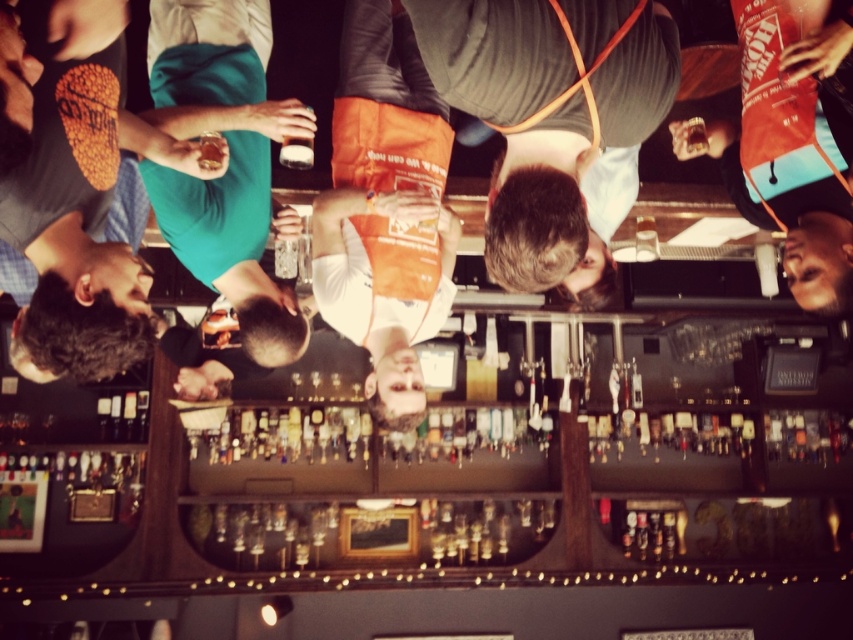
Who is more forward, (473, 38) or (653, 224)?

Point (473, 38) is more forward.

Does dark gray fabric apron at center have a lesser height compared to clear glass at center?

In fact, dark gray fabric apron at center may be taller than clear glass at center.

You are a GUI agent. You are given a task and a screenshot of the screen. Output one action in this format:
    pyautogui.click(x=<x>, y=<y>)
    Task: Click on the dark gray fabric apron at center
    
    Given the screenshot: What is the action you would take?
    pyautogui.click(x=553, y=122)